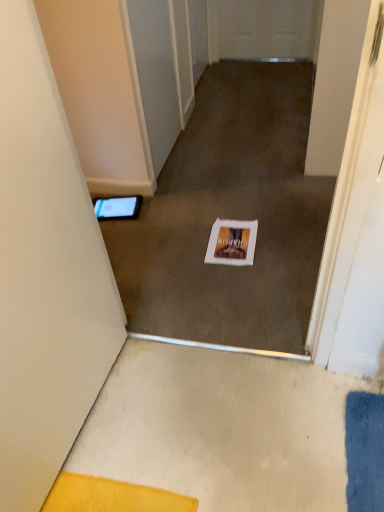
Question: Should I look upward or downward to see black glossy tablet at left?

Choices:
 (A) up
 (B) down

Answer: (A)

Question: Can you confirm if black glossy tablet at left is shorter than white matte door at left?

Choices:
 (A) yes
 (B) no

Answer: (A)

Question: From the image's perspective, is black glossy tablet at left on white matte door at left?

Choices:
 (A) no
 (B) yes

Answer: (B)

Question: Can you confirm if black glossy tablet at left is wider than white matte door at left?

Choices:
 (A) yes
 (B) no

Answer: (A)

Question: Is black glossy tablet at left thinner than white matte door at left?

Choices:
 (A) yes
 (B) no

Answer: (B)

Question: Does black glossy tablet at left appear on the right side of white matte door at left?

Choices:
 (A) yes
 (B) no

Answer: (B)

Question: Can you confirm if black glossy tablet at left is positioned to the left of white matte door at left?

Choices:
 (A) no
 (B) yes

Answer: (B)

Question: Is the position of white paper at center less distant than that of white matte door at left?

Choices:
 (A) yes
 (B) no

Answer: (B)

Question: Does white paper at center have a larger size compared to white matte door at left?

Choices:
 (A) yes
 (B) no

Answer: (B)

Question: Are white paper at center and white matte door at left far apart?

Choices:
 (A) yes
 (B) no

Answer: (B)

Question: Would you say white matte door at left is part of white paper at center's contents?

Choices:
 (A) yes
 (B) no

Answer: (B)

Question: Can you confirm if white paper at center is thinner than white matte door at left?

Choices:
 (A) yes
 (B) no

Answer: (B)

Question: Is white paper at center to the left of white matte door at left from the viewer's perspective?

Choices:
 (A) no
 (B) yes

Answer: (A)

Question: From a real-world perspective, is white matte door at left physically above white paper at center?

Choices:
 (A) yes
 (B) no

Answer: (A)